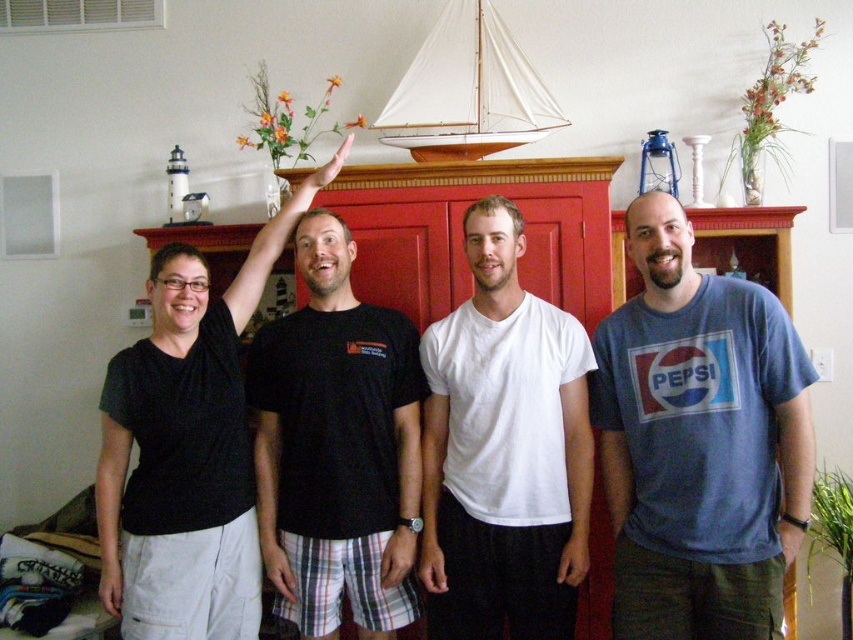
Is black cotton t-shirt at center positioned in front of black matte shirt at upper left?

No, black cotton t-shirt at center is further to the viewer.

Which is in front, point (315, 228) or point (180, 397)?

Point (180, 397)

The image size is (853, 640). What do you see at coordinates (337, 445) in the screenshot?
I see `black cotton t-shirt at center` at bounding box center [337, 445].

This screenshot has height=640, width=853. Find the location of `black cotton t-shirt at center`. black cotton t-shirt at center is located at coordinates (337, 445).

Who is more distant from viewer, (585, 561) or (238, 516)?

The point (238, 516) is behind.

Is white matte t-shirt at center below black matte shirt at upper left?

Yes, white matte t-shirt at center is below black matte shirt at upper left.

What do you see at coordinates (503, 451) in the screenshot? The height and width of the screenshot is (640, 853). I see `white matte t-shirt at center` at bounding box center [503, 451].

Locate an element on the screen. Image resolution: width=853 pixels, height=640 pixels. white matte t-shirt at center is located at coordinates (503, 451).

Does white matte t-shirt at center lie in front of black cotton t-shirt at center?

Yes.

Can you confirm if white matte t-shirt at center is bigger than black cotton t-shirt at center?

No, white matte t-shirt at center is not bigger than black cotton t-shirt at center.

Find the location of a particular element. The width and height of the screenshot is (853, 640). white matte t-shirt at center is located at coordinates point(503,451).